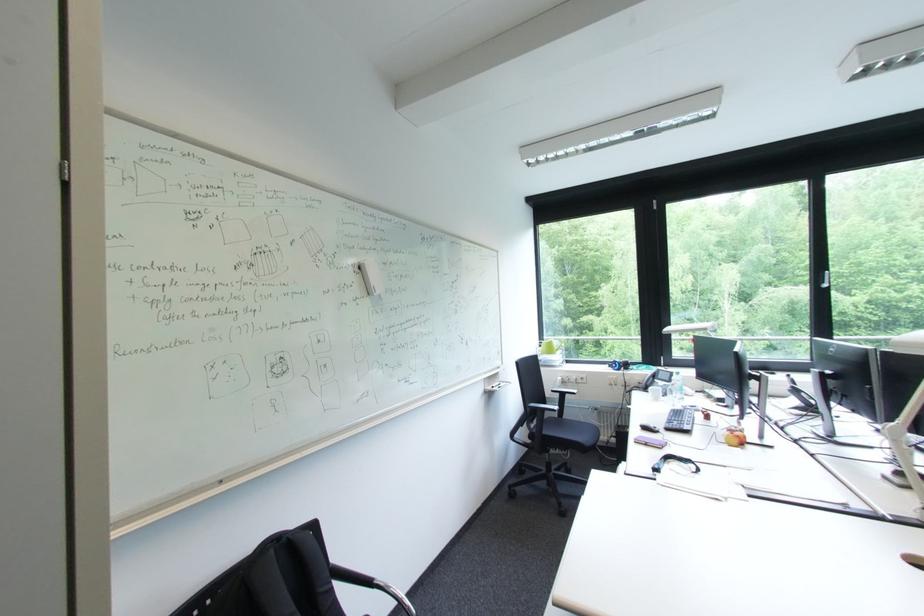
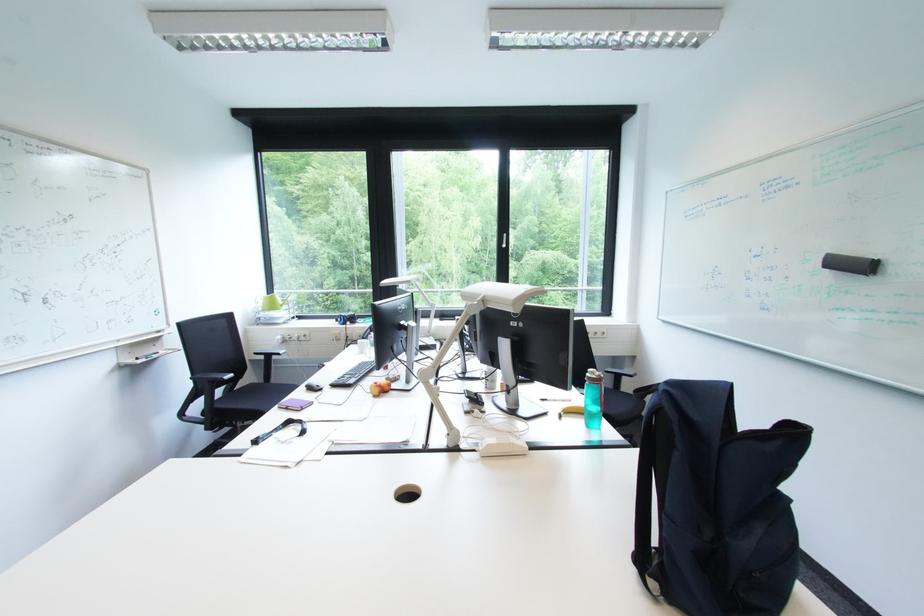
Where in the second image is the point corresponding to (662,468) from the first image?

(262, 440)